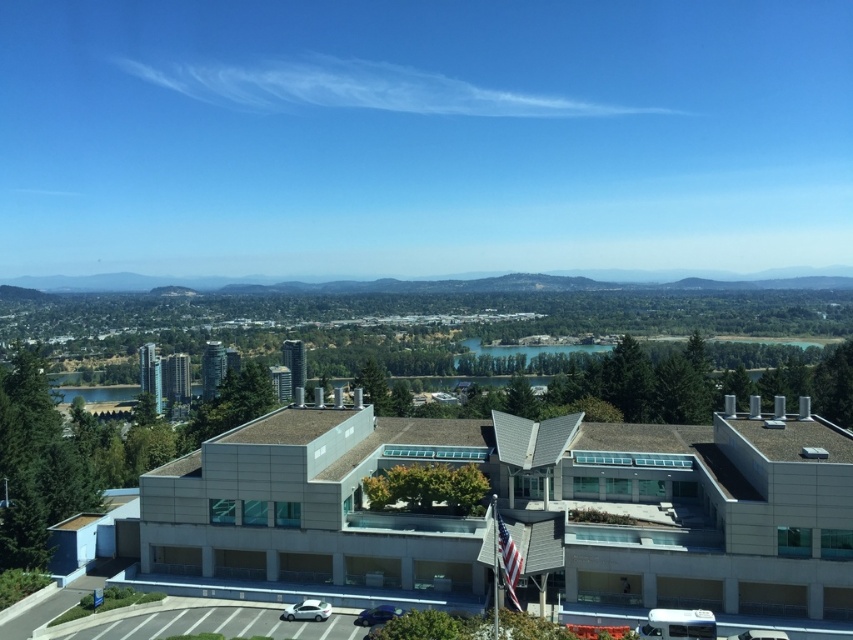
You are standing at the entrance of the modern building with a flat roof and want to locate the white glossy sedan at center. According to the coordinates provided, in which direction should you look to find it?

The white glossy sedan at center is located at coordinates point (306, 611), so you should look towards the center of the parking lot to find it.

You are a delivery driver approaching the parking lot in front of the modern building. You see a white glossy sedan at center and a shiny blue sedan at lower center. Which car should you avoid overtaking to stay within the parking lot rules?

You should avoid overtaking the white glossy sedan at center because the shiny blue sedan at lower center is behind it, so overtaking the white glossy sedan at center might lead to unsafe maneuvers in the parking lot.

You are a parking attendant who needs to fit both the white glossy sedan at center and the shiny blue sedan at lower center into a parking space that is 1.8 meters in height. Which car, if any, might not fit based on their heights?

The white glossy sedan at center is not as tall as the shiny blue sedan at lower center. Since the parking space has a height limit of 1.8 meters, the shiny blue sedan at lower center might not fit if its height exceeds the limit, while the white glossy sedan at center is shorter and likely fits.